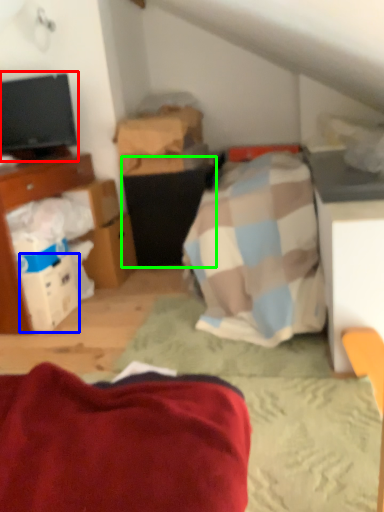
Question: Based on their relative distances, which object is farther from television (highlighted by a red box)? Choose from box (highlighted by a blue box) and vanity (highlighted by a green box).

Choices:
 (A) box
 (B) vanity

Answer: (A)